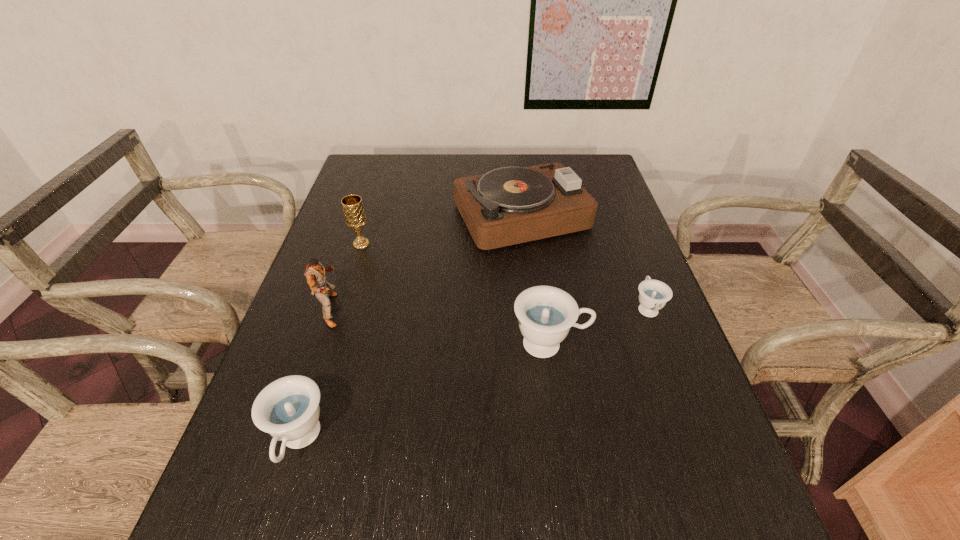
I want to click on vacant position for inserting another teacup evenly, so click(436, 388).